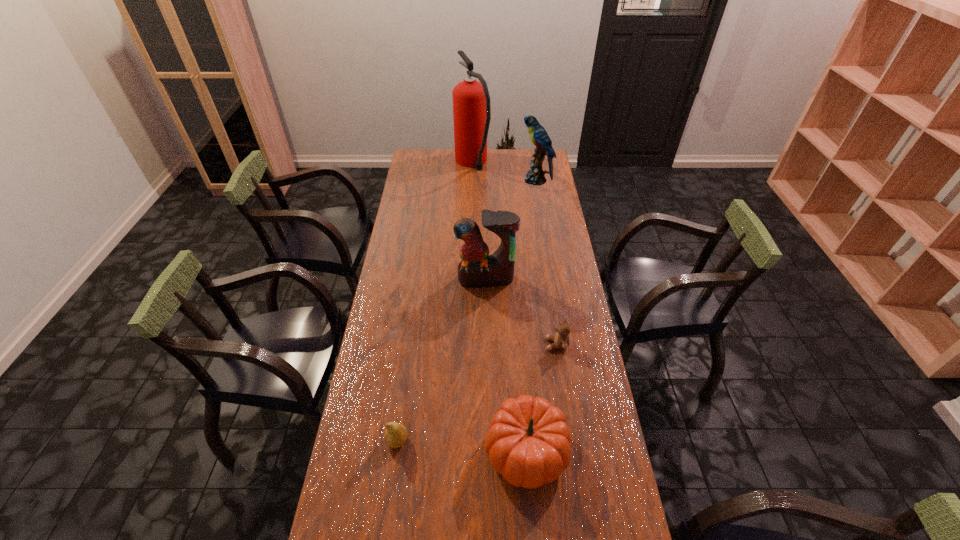
The image size is (960, 540). Find the location of `vacant area situated at the face of the nearer parrot`. vacant area situated at the face of the nearer parrot is located at coordinates (487, 360).

This screenshot has width=960, height=540. Find the location of `vacant space situated 0.130m on the back of the third shortest object`. vacant space situated 0.130m on the back of the third shortest object is located at coordinates [520, 375].

Where is `vacant space positioned 0.260m on the front-facing side of the teddy bear`? This screenshot has width=960, height=540. vacant space positioned 0.260m on the front-facing side of the teddy bear is located at coordinates (470, 344).

I want to click on free space located 0.210m on the front-facing side of the teddy bear, so click(x=485, y=344).

Identify the location of free spot located on the front-facing side of the teddy bear. (488, 344).

The width and height of the screenshot is (960, 540). What are the coordinates of `vacant space located on the front of the leftmost object` in the screenshot? It's located at [393, 476].

Locate an element on the screen. This screenshot has height=540, width=960. object that is at the far edge is located at coordinates [471, 101].

Where is `object positioned at the left edge`? The width and height of the screenshot is (960, 540). object positioned at the left edge is located at coordinates (395, 436).

You are a GUI agent. You are given a task and a screenshot of the screen. Output one action in this format:
    pyautogui.click(x=<x>, y=<y>)
    Task: Click on the parrot present at the right edge
    This screenshot has height=540, width=960.
    Given the screenshot: What is the action you would take?
    pyautogui.click(x=538, y=135)

At what (x,y) coordinates should I click in order to perform the action: click on pumpkin located at the right edge. Please return your answer as a coordinate pair (x, y). This screenshot has height=540, width=960. Looking at the image, I should click on (528, 442).